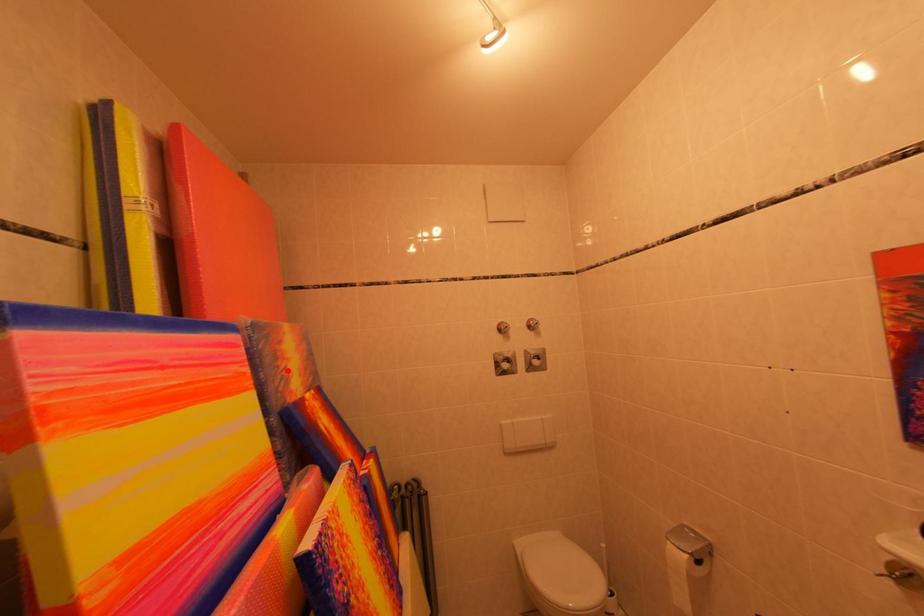
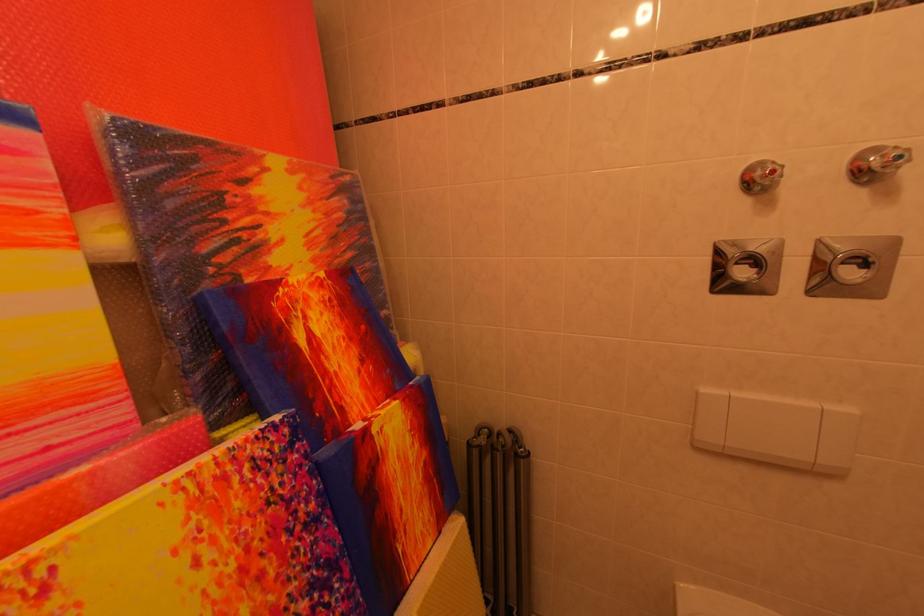
Find the pixel in the second image that matches the highlighted location in the first image.

(233, 225)